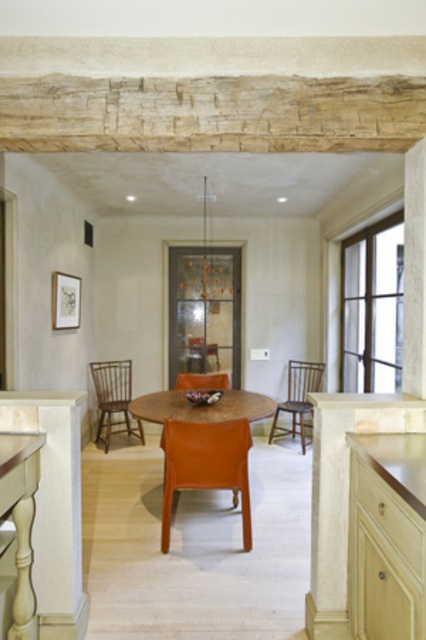
Question: Considering the real-world distances, which object is farthest from the orange plastic chair at center?

Choices:
 (A) wooden countertop at right
 (B) wooden spindle back chair at left
 (C) orange leather chair at center

Answer: (A)

Question: Is wooden spindle back chair at left to the left of orange plastic chair at center from the viewer's perspective?

Choices:
 (A) no
 (B) yes

Answer: (B)

Question: Among these objects, which one is nearest to the camera?

Choices:
 (A) wooden round table at center
 (B) orange leather chair at center
 (C) wooden countertop at right

Answer: (C)

Question: Considering the real-world distances, which object is closest to the orange leather chair at center?

Choices:
 (A) orange plastic chair at center
 (B) wooden round table at center
 (C) wooden chair at center
 (D) wooden countertop at right

Answer: (B)

Question: Can you confirm if wooden countertop at right is wider than wooden spindle back chair at left?

Choices:
 (A) no
 (B) yes

Answer: (A)

Question: Is wooden countertop at right thinner than wooden chair at center?

Choices:
 (A) yes
 (B) no

Answer: (A)